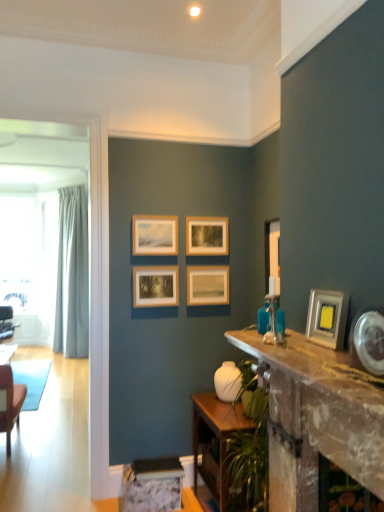
What do you see at coordinates (72, 275) in the screenshot? The height and width of the screenshot is (512, 384). I see `light blue fabric curtain at left` at bounding box center [72, 275].

At what (x,y) coordinates should I click in order to perform the action: click on wooden picture frame at upper center, acting as the sixth picture frame starting from the front. Please return your answer as a coordinate pair (x, y). This screenshot has width=384, height=512. Looking at the image, I should click on (206, 236).

What do you see at coordinates (6, 323) in the screenshot? I see `matte black chair at left` at bounding box center [6, 323].

At what (x,y) coordinates should I click in order to perform the action: click on metallic silver picture frame at right, the 6th picture frame from the back. Please return your answer as a coordinate pair (x, y). Looking at the image, I should click on (327, 318).

Considering the sizes of rustic wooden table at center, the 2th table positioned from the bottom, and white glossy vase at center in the image, is rustic wooden table at center, the 2th table positioned from the bottom, bigger or smaller than white glossy vase at center?

In the image, rustic wooden table at center, the 2th table positioned from the bottom, appears to be larger than white glossy vase at center.

Which object is closer to the camera taking this photo, rustic wooden table at center, placed as the second table when sorted from back to front, or white glossy vase at center?

rustic wooden table at center, placed as the second table when sorted from back to front, is closer to the camera.

Which point is more forward, [298,447] or [226,366]?

The point [298,447] is closer to the camera.

Identify the location of the 2nd table to the right of the white glossy vase at center, starting your count from the anchor. (316, 418).

Is matte black chair at left inside the boundaries of white glossy vase at center, or outside?

matte black chair at left is located beyond the bounds of white glossy vase at center.

Is matte black chair at left oriented towards white glossy vase at center?

Yes, matte black chair at left is turned towards white glossy vase at center.

Considering the relative sizes of matte black chair at left and white glossy vase at center in the image provided, is matte black chair at left wider than white glossy vase at center?

Yes.

From the image's perspective, which object appears higher, matte black chair at left or white glossy vase at center?

white glossy vase at center, from the image's perspective.

Is metallic silver picture frame at right, the 6th picture frame from the back, facing towards matte black chair at left?

No, metallic silver picture frame at right, the 6th picture frame from the back, is not facing towards matte black chair at left.

Is metallic silver picture frame at right, the 6th picture frame from the back, far from matte black chair at left?

Yes, metallic silver picture frame at right, the 6th picture frame from the back, is far from matte black chair at left.

From the picture: From the image's perspective, is metallic silver picture frame at right, positioned as the 1th picture frame in front-to-back order, above matte black chair at left?

Indeed, from the image's perspective, metallic silver picture frame at right, positioned as the 1th picture frame in front-to-back order, is shown above matte black chair at left.

Based on the photo, is wooden picture frame at upper center, acting as the sixth picture frame starting from the front, behind rustic wooden table at center, which is the 1th table from top to bottom?

Yes, wooden picture frame at upper center, acting as the sixth picture frame starting from the front, is further from the viewer.

Which is behind, point (211, 239) or point (337, 449)?

Positioned behind is point (211, 239).

Considering the relative sizes of wooden picture frame at upper center, acting as the sixth picture frame starting from the front, and rustic wooden table at center, the 2th table positioned from the bottom, in the image provided, is wooden picture frame at upper center, acting as the sixth picture frame starting from the front, shorter than rustic wooden table at center, the 2th table positioned from the bottom,?

Correct, wooden picture frame at upper center, acting as the sixth picture frame starting from the front, is not as tall as rustic wooden table at center, the 2th table positioned from the bottom.

Between point (276, 228) and point (71, 350), which one is positioned behind?

The point (71, 350) is farther from the camera.

Is white glossy picture frame at right, which ranks as the second picture frame in front-to-back order, directly adjacent to light blue fabric curtain at left?

No, white glossy picture frame at right, which ranks as the second picture frame in front-to-back order, is not beside light blue fabric curtain at left.

Can you tell me how much white glossy picture frame at right, which ranks as the second picture frame in front-to-back order, and light blue fabric curtain at left differ in facing direction?

44.9 degrees separate the facing orientations of white glossy picture frame at right, which ranks as the second picture frame in front-to-back order, and light blue fabric curtain at left.

How far apart are white glossy picture frame at right, which ranks as the second picture frame in front-to-back order, and light blue fabric curtain at left?

white glossy picture frame at right, which ranks as the second picture frame in front-to-back order, and light blue fabric curtain at left are 3.42 meters apart from each other.

Does metallic silver picture frame at right, positioned as the 1th picture frame in front-to-back order, turn towards wooden picture frame at center, which ranks as the fourth picture frame in back-to-front order?

No, metallic silver picture frame at right, positioned as the 1th picture frame in front-to-back order, does not turn towards wooden picture frame at center, which ranks as the fourth picture frame in back-to-front order.

Considering the relative sizes of metallic silver picture frame at right, the 6th picture frame from the back, and wooden picture frame at center, the third picture frame from the front, in the image provided, is metallic silver picture frame at right, the 6th picture frame from the back, shorter than wooden picture frame at center, the third picture frame from the front,?

Indeed, metallic silver picture frame at right, the 6th picture frame from the back, has a lesser height compared to wooden picture frame at center, the third picture frame from the front.

From the picture: Measure the distance from metallic silver picture frame at right, the 6th picture frame from the back, to wooden picture frame at center, the third picture frame from the front.

5.17 feet.

You are a GUI agent. You are given a task and a screenshot of the screen. Output one action in this format:
    pyautogui.click(x=<x>, y=<y>)
    Task: Click on the picture frame that is the 2nd one when counting forward from the wooden picture frame at center, the third picture frame from the front
    
    Given the screenshot: What is the action you would take?
    pyautogui.click(x=327, y=318)

Considering the relative sizes of matte black chair at left and rustic wooden table at center, placed as the second table when sorted from back to front, in the image provided, is matte black chair at left smaller than rustic wooden table at center, placed as the second table when sorted from back to front,?

Indeed, matte black chair at left has a smaller size compared to rustic wooden table at center, placed as the second table when sorted from back to front.

From the image's perspective, between matte black chair at left and rustic wooden table at center, which ranks as the 1th table in front-to-back order, who is located below?

matte black chair at left.

Which of these two, matte black chair at left or rustic wooden table at center, the 2th table positioned from the bottom, is wider?

matte black chair at left is wider.

Where is `table that is above the white glossy vase at center (from a real-world perspective)`? The image size is (384, 512). table that is above the white glossy vase at center (from a real-world perspective) is located at coordinates (316, 418).

Where is `chair below the white glossy vase at center (from the image's perspective)`? The image size is (384, 512). chair below the white glossy vase at center (from the image's perspective) is located at coordinates (6, 323).

When comparing their distances from wooden picture frame at center, arranged as the second picture frame when viewed from the back, does matte black chair at left or white glossy picture frame at right, which ranks as the second picture frame in front-to-back order, seem further?

The object further to wooden picture frame at center, arranged as the second picture frame when viewed from the back, is matte black chair at left.

When comparing their distances from wooden picture frame at upper center, which is the third picture frame from back to front, does wooden picture frame at center, the third picture frame from the front, or wooden picture frame at upper center, which is the first picture frame from back to front, seem further?

wooden picture frame at upper center, which is the first picture frame from back to front, is positioned further to the anchor wooden picture frame at upper center, which is the third picture frame from back to front.

From the image, which object appears to be nearer to rustic wooden table at center, the 2th table positioned from the bottom, metallic silver picture frame at right, positioned as the 1th picture frame in front-to-back order, or wooden table at lower center, which is the first table in bottom-to-top order?

metallic silver picture frame at right, positioned as the 1th picture frame in front-to-back order, is closer to rustic wooden table at center, the 2th table positioned from the bottom.

Which object lies further to the anchor point white glossy vase at center, metallic silver picture frame at right, positioned as the 1th picture frame in front-to-back order, or rustic wooden table at center, the 2th table positioned from the bottom?

metallic silver picture frame at right, positioned as the 1th picture frame in front-to-back order, is further to white glossy vase at center.

Estimate the real-world distances between objects in this image. Which object is further from light blue fabric curtain at left, rustic wooden table at center, which ranks as the 1th table in front-to-back order, or metallic silver picture frame at right, the 6th picture frame from the back?

metallic silver picture frame at right, the 6th picture frame from the back, is further to light blue fabric curtain at left.

Which object lies nearer to the anchor point wooden picture frame at center, which ranks as the fourth picture frame in back-to-front order, wooden picture frame at upper center, acting as the sixth picture frame starting from the front, or wooden table at lower center, which is counted as the 1th table, starting from the back?

Based on the image, wooden picture frame at upper center, acting as the sixth picture frame starting from the front, appears to be nearer to wooden picture frame at center, which ranks as the fourth picture frame in back-to-front order.

Based on their spatial positions, is wooden picture frame at upper center, the fourth picture frame in the front-to-back sequence, or matte black chair at left further from wooden picture frame at upper center, which is the first picture frame from back to front?

matte black chair at left.

Estimate the real-world distances between objects in this image. Which object is closer to light blue fabric curtain at left, white glossy picture frame at right, which ranks as the second picture frame in front-to-back order, or metallic silver picture frame at right, positioned as the 1th picture frame in front-to-back order?

Based on the image, white glossy picture frame at right, which ranks as the second picture frame in front-to-back order, appears to be nearer to light blue fabric curtain at left.

Image resolution: width=384 pixels, height=512 pixels. Identify the location of picture frame between wooden picture frame at center, which ranks as the fourth picture frame in back-to-front order, and wooden picture frame at center, arranged as the second picture frame when viewed from the back. (206, 236).

The image size is (384, 512). What are the coordinates of `table positioned between rustic wooden table at center, placed as the second table when sorted from back to front, and wooden picture frame at center, the third picture frame from the front, from near to far` in the screenshot? It's located at click(x=215, y=439).

I want to click on table located between rustic wooden table at center, placed as the second table when sorted from back to front, and light blue fabric curtain at left in the depth direction, so click(215, 439).

You are a GUI agent. You are given a task and a screenshot of the screen. Output one action in this format:
    pyautogui.click(x=<x>, y=<y>)
    Task: Click on the curtain positioned between wooden picture frame at center, arranged as the second picture frame when viewed from the back, and matte black chair at left from near to far
    The width and height of the screenshot is (384, 512).
    Given the screenshot: What is the action you would take?
    pos(72,275)